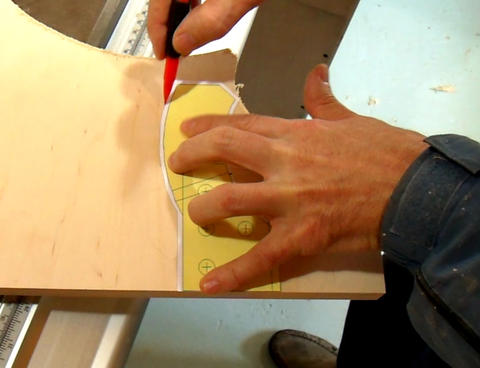
At what (x,y) coordinates should I click in order to perform the action: click on floor. Please return your answer as a coordinate pair (x, y). The image size is (480, 368). Looking at the image, I should click on (195, 337).